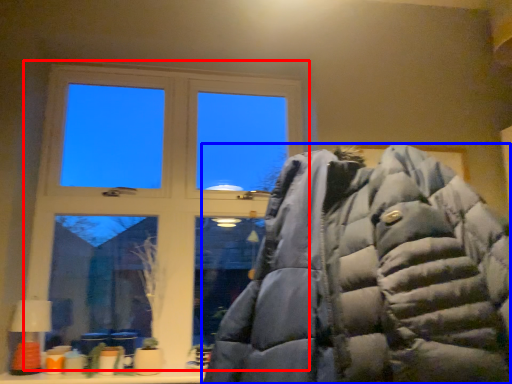
Question: Which point is closer to the camera, window (highlighted by a red box) or jacket (highlighted by a blue box)?

Choices:
 (A) window
 (B) jacket

Answer: (B)